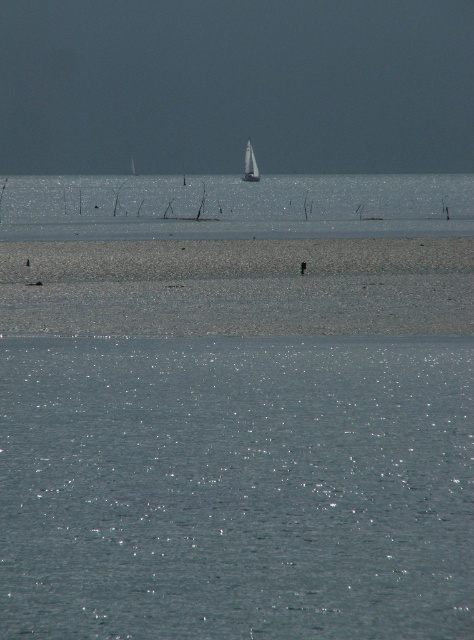
Is sparkling silver water at center bigger than white glossy sailboat at upper center?

Actually, sparkling silver water at center might be smaller than white glossy sailboat at upper center.

The width and height of the screenshot is (474, 640). What are the coordinates of `sparkling silver water at center` in the screenshot? It's located at (236, 486).